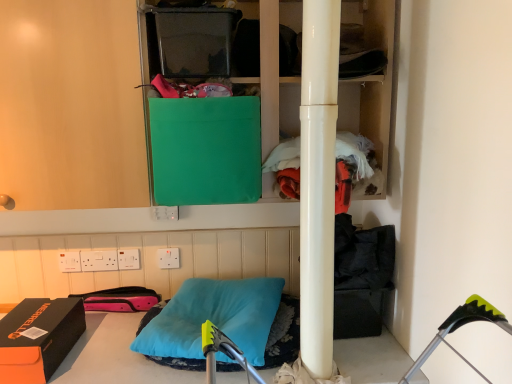
Question: From a real-world perspective, is orange fleece jacket at center right positioned above or below teal soft pillow at center?

Choices:
 (A) above
 (B) below

Answer: (A)

Question: Visually, is orange fleece jacket at center right positioned to the left or to the right of teal soft pillow at center?

Choices:
 (A) left
 (B) right

Answer: (B)

Question: Estimate the real-world distances between objects in this image. Which object is closer to the orange fleece jacket at center right?

Choices:
 (A) white plastic electric outlet at lower center, which is the 5th electric outlet in left-to-right order
 (B) orange matte shoebox at lower left, marked as the first box in a left-to-right arrangement
 (C) white plastic electric outlet at center, arranged as the second electric outlet when viewed from the right
 (D) glossy white pole at center
 (E) teal soft pillow at center

Answer: (D)

Question: Estimate the real-world distances between objects in this image. Which object is closer to the white plastic electric outlet at lower center, placed as the 1th electric outlet when sorted from left to right?

Choices:
 (A) orange fleece jacket at center right
 (B) green fabric bag at upper center
 (C) white plastic electric outlet at center, arranged as the second electric outlet when viewed from the right
 (D) teal soft pillow at center
 (E) white plastic electric outlet at upper center, which is the third electric outlet from left to right

Answer: (E)